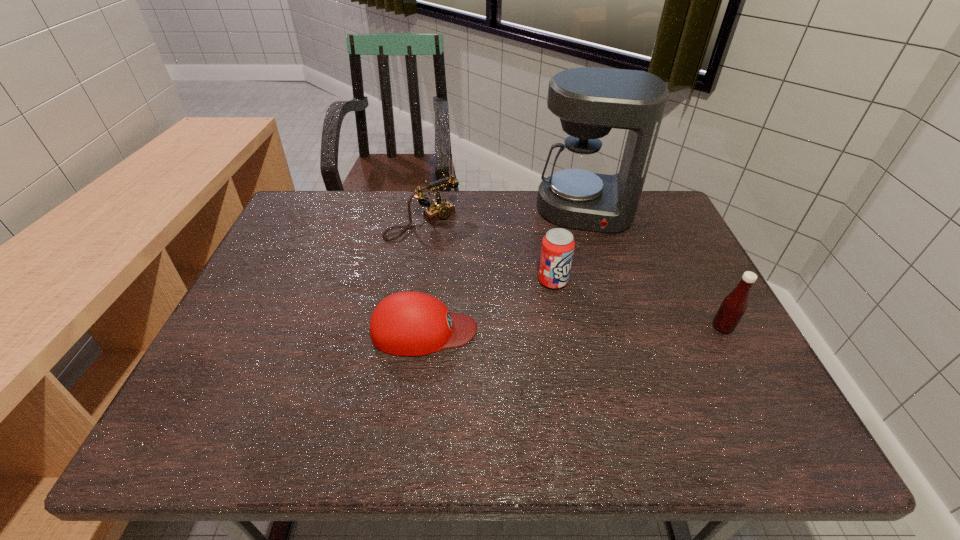
At what (x,y) coordinates should I click in order to perform the action: click on vacant area in the image that satisfies the following two spatial constraints: 1. on the front side of the rightmost object; 2. on the left side of the third nearest object. Please return your answer as a coordinate pair (x, y). The image size is (960, 540). Looking at the image, I should click on (562, 327).

Identify the location of free spot that satisfies the following two spatial constraints: 1. on the front side of the shortest object; 2. on the front-facing side of the telephone. The width and height of the screenshot is (960, 540). (406, 330).

Find the location of `free space that satisfies the following two spatial constraints: 1. on the back side of the tallest object; 2. on the right side of the telephone`. free space that satisfies the following two spatial constraints: 1. on the back side of the tallest object; 2. on the right side of the telephone is located at coordinates (424, 211).